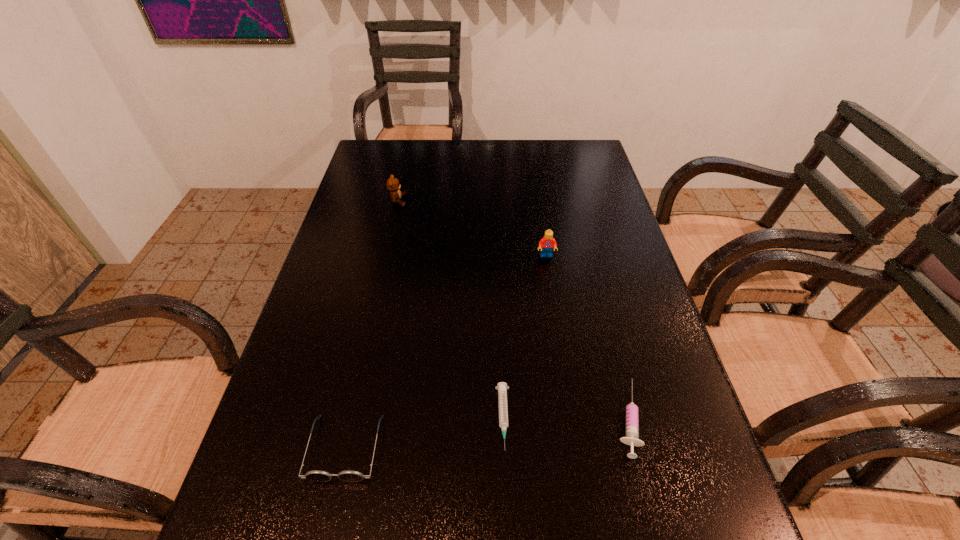
Find the location of a particular element. Image resolution: width=960 pixels, height=540 pixels. vacant region between the right syringe and the Lego is located at coordinates (587, 337).

You are a GUI agent. You are given a task and a screenshot of the screen. Output one action in this format:
    pyautogui.click(x=<x>, y=<y>)
    Task: Click on the object that is the second nearest to the Lego
    Image resolution: width=960 pixels, height=540 pixels.
    Given the screenshot: What is the action you would take?
    pyautogui.click(x=502, y=387)

I want to click on the third closest object to the fourth nearest object, so click(393, 186).

You are a GUI agent. You are given a task and a screenshot of the screen. Output one action in this format:
    pyautogui.click(x=<x>, y=<y>)
    Task: Click on the vacant region that satisfies the following two spatial constraints: 1. on the face of the taller syringe; 2. on the right side of the fourth object from left to right
    The height and width of the screenshot is (540, 960).
    Given the screenshot: What is the action you would take?
    pyautogui.click(x=572, y=418)

Find the location of `free point that satisfies the following two spatial constraints: 1. at the needle end of the second shortest object; 2. on the right side of the left syringe`. free point that satisfies the following two spatial constraints: 1. at the needle end of the second shortest object; 2. on the right side of the left syringe is located at coordinates (503, 418).

You are a GUI agent. You are given a task and a screenshot of the screen. Output one action in this format:
    pyautogui.click(x=<x>, y=<y>)
    Task: Click on the free space that satisfies the following two spatial constraints: 1. on the face of the rightmost object; 2. on the right side of the fourth nearest object
    This screenshot has height=540, width=960.
    Given the screenshot: What is the action you would take?
    pyautogui.click(x=572, y=418)

Locate an element on the screen. This screenshot has height=540, width=960. vacant space that satisfies the following two spatial constraints: 1. at the needle end of the taller syringe; 2. on the right side of the shortest object is located at coordinates (503, 418).

At what (x,y) coordinates should I click in order to perform the action: click on free spot that satisfies the following two spatial constraints: 1. on the front-facing side of the farthest object; 2. on the right side of the fourth tallest object. Please return your answer as a coordinate pair (x, y). The width and height of the screenshot is (960, 540). Looking at the image, I should click on (349, 418).